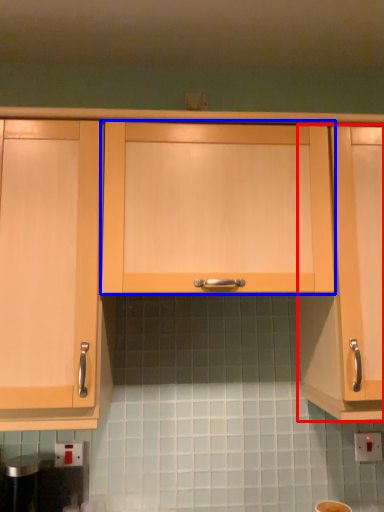
Question: Which of the following is the farthest to the observer, cabinetry (highlighted by a red box) or cabinetry (highlighted by a blue box)?

Choices:
 (A) cabinetry
 (B) cabinetry

Answer: (A)